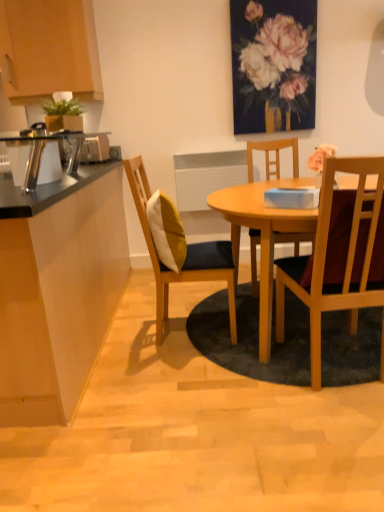
Measure the distance between point (91, 144) and camera.

The depth of point (91, 144) is 2.83 meters.

What is the approximate width of matte floral painting at upper center?

matte floral painting at upper center is 5.28 centimeters in width.

What is the approximate height of matte floral painting at upper center?

matte floral painting at upper center is 37.74 inches in height.

What do you see at coordinates (43, 149) in the screenshot? This screenshot has height=512, width=384. I see `metallic silver toaster at left, arranged as the 2th appliance when viewed from the back` at bounding box center [43, 149].

This screenshot has width=384, height=512. Describe the element at coordinates (186, 256) in the screenshot. I see `wooden chair with cushion at center, which is the 1th chair in left-to-right order` at that location.

This screenshot has width=384, height=512. I want to click on wooden chair with cushion at center, arranged as the second chair when viewed from the right, so click(186, 256).

Locate an element on the screen. The height and width of the screenshot is (512, 384). matte white desk at left is located at coordinates (57, 289).

Is yellow fabric pillow at center to the left or to the right of matte floral painting at upper center in the image?

yellow fabric pillow at center is positioned on matte floral painting at upper center's left side.

From the image's perspective, is yellow fabric pillow at center on top of matte floral painting at upper center?

No, from the image's perspective, yellow fabric pillow at center is not over matte floral painting at upper center.

Is metallic silver toaster at left, acting as the 2th appliance starting from the top, wider or thinner than wooden chair at right, which ranks as the second chair in left-to-right order?

metallic silver toaster at left, acting as the 2th appliance starting from the top, is thinner than wooden chair at right, which ranks as the second chair in left-to-right order.

Is point (82, 133) closer or farther from the camera than point (308, 290)?

Point (82, 133) is farther from the camera than point (308, 290).

From the image's perspective, who appears lower, metallic silver toaster at left, arranged as the 2th appliance when viewed from the back, or wooden chair at right, which is the first chair in right-to-left order?

wooden chair at right, which is the first chair in right-to-left order.

From their relative heights in the image, would you say metallic silver toaster at left, acting as the 1th appliance starting from the bottom, is taller or shorter than wooden chair at right, which is the first chair in right-to-left order?

Considering their sizes, metallic silver toaster at left, acting as the 1th appliance starting from the bottom, has less height than wooden chair at right, which is the first chair in right-to-left order.

Between wooden chair at right, which is the first chair in right-to-left order, and matte white desk at left, which one has more height?

wooden chair at right, which is the first chair in right-to-left order.

What's the angular difference between wooden chair at right, which ranks as the second chair in left-to-right order, and matte white desk at left's facing directions?

The angular difference between wooden chair at right, which ranks as the second chair in left-to-right order, and matte white desk at left is 90.2 degrees.

From a real-world perspective, is wooden chair at right, which ranks as the second chair in left-to-right order, under matte white desk at left?

Incorrect, from a real-world perspective, wooden chair at right, which ranks as the second chair in left-to-right order, is higher than matte white desk at left.

Is wooden chair at right, which ranks as the second chair in left-to-right order, far away from matte white desk at left?

Indeed, wooden chair at right, which ranks as the second chair in left-to-right order, is not near matte white desk at left.

Is yellow fabric pillow at center with wooden cabinet at upper left?

No, yellow fabric pillow at center is not beside wooden cabinet at upper left.

How different are the orientations of yellow fabric pillow at center and wooden cabinet at upper left in degrees?

93.4 degrees.

Is wooden cabinet at upper left at the back of yellow fabric pillow at center?

yellow fabric pillow at center is not turned away from wooden cabinet at upper left.

Is yellow fabric pillow at center to the right of wooden cabinet at upper left from the viewer's perspective?

Yes, yellow fabric pillow at center is to the right of wooden cabinet at upper left.

Is matte white desk at left not within wooden chair with cushion at center, which is the 1th chair in left-to-right order?

Yes, matte white desk at left is located beyond the bounds of wooden chair with cushion at center, which is the 1th chair in left-to-right order.

Is matte white desk at left in front of or behind wooden chair with cushion at center, arranged as the second chair when viewed from the right, in the image?

matte white desk at left is positioned closer to the viewer than wooden chair with cushion at center, arranged as the second chair when viewed from the right.

Considering the points (9, 237) and (170, 278), which point is in front, point (9, 237) or point (170, 278)?

The point (9, 237) is closer.

From a real-world perspective, which object rests below the other?

matte white desk at left.

Is wooden chair with cushion at center, which is the 1th chair in left-to-right order, positioned with its back to wooden cabinet at upper left?

No, wooden chair with cushion at center, which is the 1th chair in left-to-right order,'s orientation is not away from wooden cabinet at upper left.

Which is more to the right, wooden chair with cushion at center, arranged as the second chair when viewed from the right, or wooden cabinet at upper left?

wooden chair with cushion at center, arranged as the second chair when viewed from the right, is more to the right.

From the image's perspective, is wooden chair with cushion at center, which is the 1th chair in left-to-right order, below wooden cabinet at upper left?

Yes, from the image's perspective, wooden chair with cushion at center, which is the 1th chair in left-to-right order, is below wooden cabinet at upper left.

Is point (164, 326) closer or farther from the camera than point (92, 7)?

Point (164, 326) is closer to the camera than point (92, 7).

In the scene shown: From a real-world perspective, who is located higher, matte floral painting at upper center or yellow fabric pillow at center?

matte floral painting at upper center is physically above.

In terms of width, does matte floral painting at upper center look wider or thinner when compared to yellow fabric pillow at center?

matte floral painting at upper center is thinner than yellow fabric pillow at center.

Considering the relative sizes of matte floral painting at upper center and yellow fabric pillow at center in the image provided, is matte floral painting at upper center smaller than yellow fabric pillow at center?

Yes, matte floral painting at upper center is smaller than yellow fabric pillow at center.

In the image, is matte floral painting at upper center on the left side or the right side of yellow fabric pillow at center?

matte floral painting at upper center is positioned on yellow fabric pillow at center's right side.

Locate an element on the screen. The image size is (384, 512). floral arrangement behind the yellow fabric pillow at center is located at coordinates (273, 64).

Starting from the metallic silver toaster at left, placed as the first appliance when sorted from front to back, which chair is the 2nd one to the right? Please provide its 2D coordinates.

[(339, 256)]

Based on their spatial positions, is matte white desk at left or wooden chair with cushion at center, arranged as the second chair when viewed from the right, closer to metallic silver toaster at left, the 1th appliance when ordered from back to front?

matte white desk at left is closer to metallic silver toaster at left, the 1th appliance when ordered from back to front.

Based on their spatial positions, is wooden chair at right, which is the first chair in right-to-left order, or wooden chair with cushion at center, arranged as the second chair when viewed from the right, closer to matte white desk at left?

wooden chair with cushion at center, arranged as the second chair when viewed from the right.

Which object lies further to the anchor point yellow fabric pillow at center, matte white desk at left or wooden cabinet at upper left?

Among the two, wooden cabinet at upper left is located further to yellow fabric pillow at center.

Which object lies further to the anchor point metallic silver toaster at left, the second appliance from the bottom, metallic silver toaster at left, arranged as the 2th appliance when viewed from the back, or matte white desk at left?

The object further to metallic silver toaster at left, the second appliance from the bottom, is matte white desk at left.

From the image, which object appears to be farther from matte white desk at left, wooden cabinet at upper left or wooden chair at right, which is the first chair in right-to-left order?

The object further to matte white desk at left is wooden cabinet at upper left.

From the image, which object appears to be nearer to wooden chair at right, which is the first chair in right-to-left order, wooden chair with cushion at center, which is the 1th chair in left-to-right order, or yellow fabric pillow at center?

The object closer to wooden chair at right, which is the first chair in right-to-left order, is wooden chair with cushion at center, which is the 1th chair in left-to-right order.

Considering their positions, is yellow fabric pillow at center positioned further to matte floral painting at upper center than wooden chair with cushion at center, which is the 1th chair in left-to-right order?

yellow fabric pillow at center is further to matte floral painting at upper center.

Consider the image. Looking at the image, which one is located closer to matte white desk at left, metallic silver toaster at left, the second appliance from the bottom, or yellow fabric pillow at center?

Based on the image, yellow fabric pillow at center appears to be nearer to matte white desk at left.

In order to click on chair that lies between matte floral painting at upper center and wooden chair at right, which is the first chair in right-to-left order, from top to bottom in this screenshot , I will do `click(186, 256)`.

Find the location of a particular element. appliance between matte white desk at left and metallic silver toaster at left, the 1th appliance viewed from the top, in the front-back direction is located at coordinates (43, 149).

At what (x,y) coordinates should I click in order to perform the action: click on pillow between wooden chair at right, which is the first chair in right-to-left order, and metallic silver toaster at left, the 1th appliance viewed from the top, from front to back. Please return your answer as a coordinate pair (x, y). Image resolution: width=384 pixels, height=512 pixels. Looking at the image, I should click on (166, 231).

I want to click on pillow positioned between metallic silver toaster at left, acting as the 2th appliance starting from the top, and metallic silver toaster at left, the 1th appliance viewed from the top, from near to far, so click(166, 231).